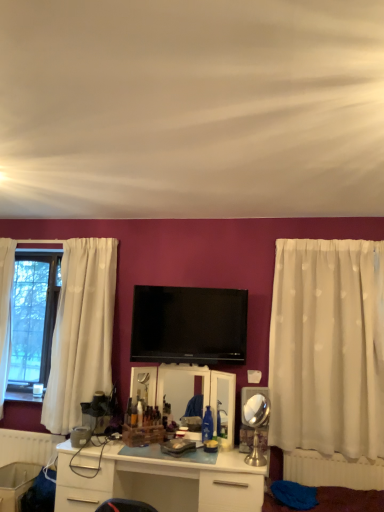
Question: Would you say white plastic radiator at lower left, which ranks as the first radiator in back-to-front order, contains white plastic radiator at lower right, the 1th radiator viewed from the front?

Choices:
 (A) no
 (B) yes

Answer: (A)

Question: Is white plastic radiator at lower left, the 1th radiator from the left, far from white plastic radiator at lower right, which is the second radiator from back to front?

Choices:
 (A) yes
 (B) no

Answer: (A)

Question: From the image's perspective, is white plastic radiator at lower left, positioned as the 2th radiator in front-to-back order, on top of white plastic radiator at lower right, marked as the 2th radiator in a left-to-right arrangement?

Choices:
 (A) yes
 (B) no

Answer: (B)

Question: Does white plastic radiator at lower left, positioned as the second radiator in right-to-left order, have a larger size compared to white plastic radiator at lower right, which is the second radiator from back to front?

Choices:
 (A) yes
 (B) no

Answer: (A)

Question: Considering the relative sizes of white plastic radiator at lower left, the 1th radiator from the left, and white plastic radiator at lower right, which is the second radiator from back to front, in the image provided, is white plastic radiator at lower left, the 1th radiator from the left, smaller than white plastic radiator at lower right, which is the second radiator from back to front,?

Choices:
 (A) no
 (B) yes

Answer: (A)

Question: Is the depth of white plastic radiator at lower left, positioned as the second radiator in right-to-left order, greater than that of white plastic radiator at lower right, which is the second radiator from back to front?

Choices:
 (A) no
 (B) yes

Answer: (B)

Question: Considering the relative sizes of white plastic radiator at lower left, positioned as the 2th radiator in front-to-back order, and white sheer curtain at right in the image provided, is white plastic radiator at lower left, positioned as the 2th radiator in front-to-back order, bigger than white sheer curtain at right?

Choices:
 (A) no
 (B) yes

Answer: (A)

Question: Can you confirm if white plastic radiator at lower left, positioned as the second radiator in right-to-left order, is smaller than white sheer curtain at right?

Choices:
 (A) no
 (B) yes

Answer: (B)

Question: Is white plastic radiator at lower left, positioned as the second radiator in right-to-left order, placed right next to white sheer curtain at right?

Choices:
 (A) yes
 (B) no

Answer: (B)

Question: Is white plastic radiator at lower left, positioned as the second radiator in right-to-left order, outside of white sheer curtain at right?

Choices:
 (A) no
 (B) yes

Answer: (B)

Question: Is white plastic radiator at lower left, positioned as the 2th radiator in front-to-back order, to the left of white sheer curtain at right from the viewer's perspective?

Choices:
 (A) yes
 (B) no

Answer: (A)

Question: Can you confirm if white plastic radiator at lower left, positioned as the 2th radiator in front-to-back order, is taller than white sheer curtain at right?

Choices:
 (A) no
 (B) yes

Answer: (A)